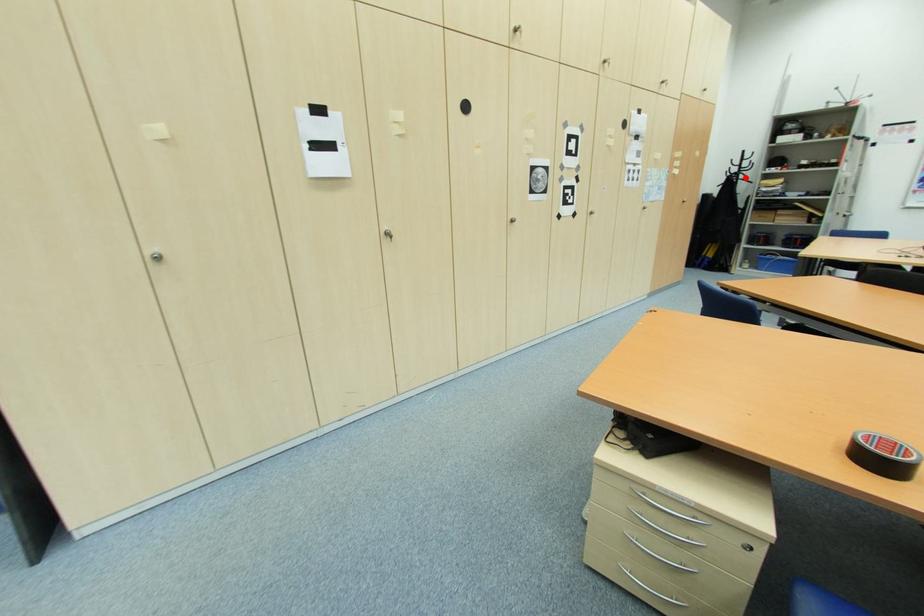
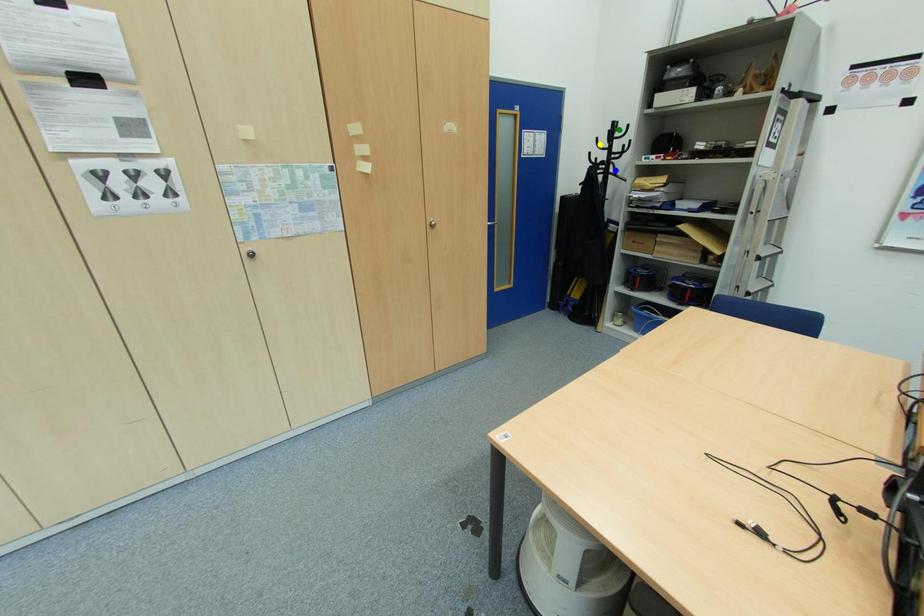
Question: I am providing you with two images of the same scene from different viewpoints. A red point is marked on the first image. You are given multiple points on the second image. Can you choose the point in image 2 that corresponds to the point in image 1?

Choices:
 (A) green point
 (B) blue point
 (C) yellow point

Answer: (B)